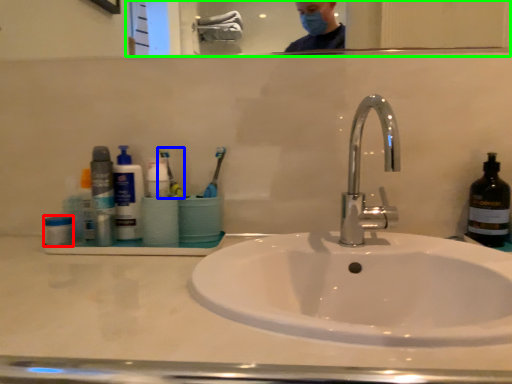
Question: Considering the real-world distances, which object is closest to mouthwash (highlighted by a red box)? toothbrush (highlighted by a blue box) or mirror (highlighted by a green box).

Choices:
 (A) toothbrush
 (B) mirror

Answer: (A)